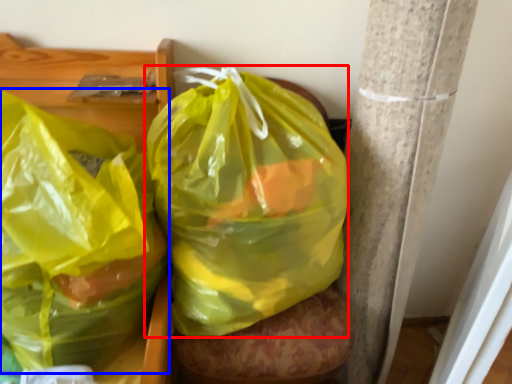
Question: Which object appears closest to the camera in this image, plastic bag (highlighted by a red box) or plastic bag (highlighted by a blue box)?

Choices:
 (A) plastic bag
 (B) plastic bag

Answer: (B)